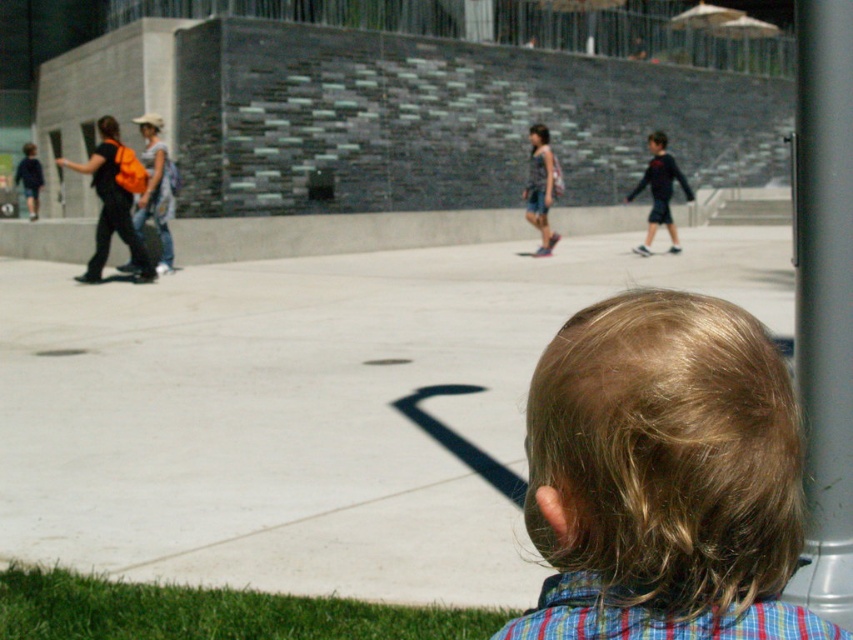
You are standing at the point marked by the coordinates point (212,612) in the image. Looking around, you see the scene described. What is the first object you would encounter if you walk straight ahead from this point?

The first object you would encounter if you walk straight ahead from point (212,612) is the green grass at lower left, as the point indicates its location.

You are a photographer setting up a shot of the scene. You want to include both the green grass at lower left and the denim shorts at center in your frame. Which object should you focus on first to ensure both are in the frame?

The green grass at lower left is smaller than the denim shorts at center, so you should focus on the denim shorts at center first to ensure both fit within the frame.